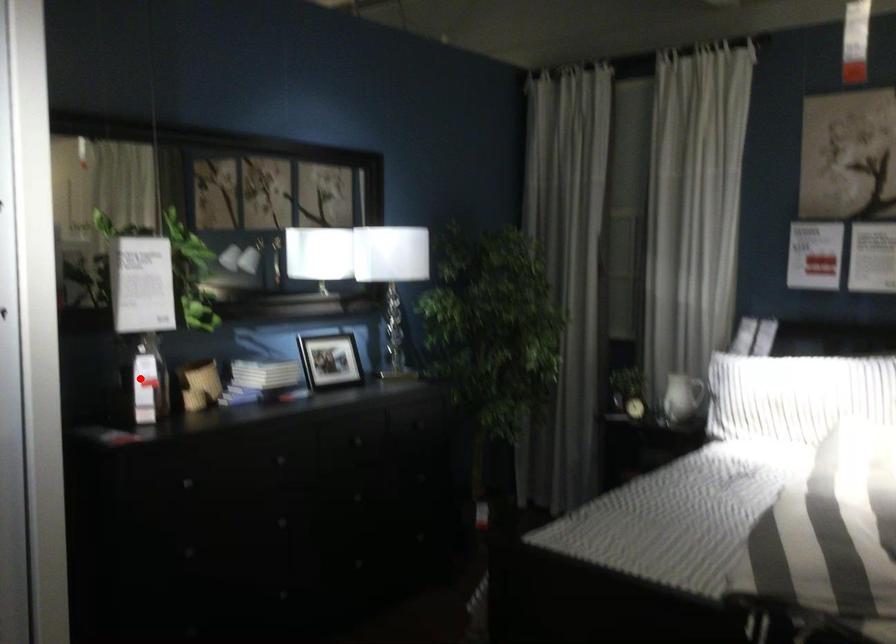
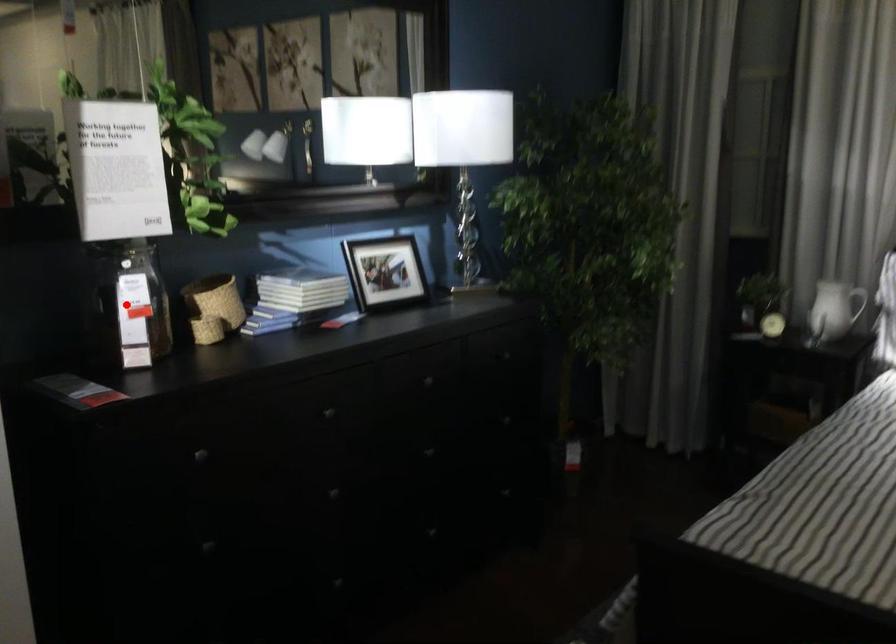
I am providing you with two images of the same scene from different viewpoints. A red point is marked on the first image and another point is marked on the second image. Is the marked point in image1 the same physical position as the marked point in image2?

Yes